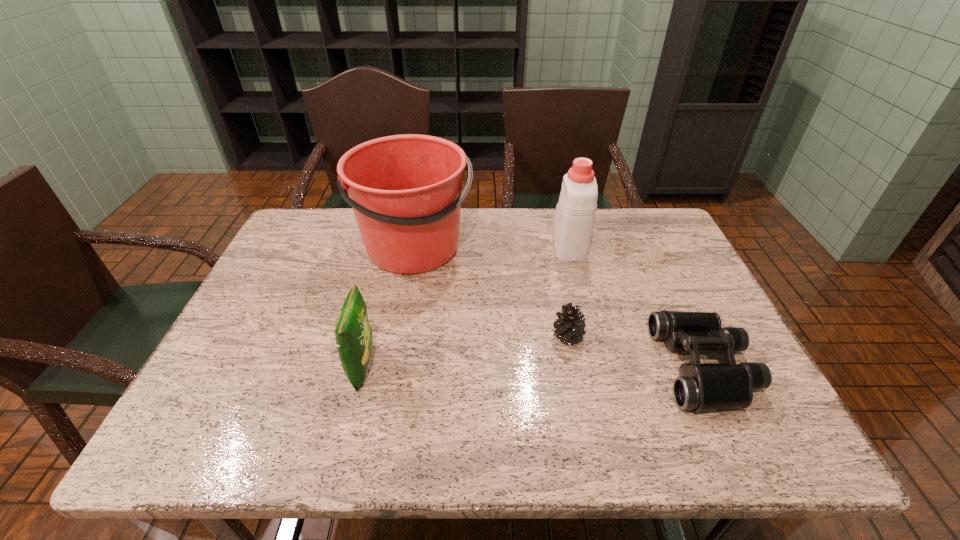
Where is `free location at the near edge of the desktop`? The height and width of the screenshot is (540, 960). free location at the near edge of the desktop is located at coordinates (298, 455).

You are a GUI agent. You are given a task and a screenshot of the screen. Output one action in this format:
    pyautogui.click(x=<x>, y=<y>)
    Task: Click on the vacant space at the left edge of the desktop
    
    Given the screenshot: What is the action you would take?
    pyautogui.click(x=300, y=272)

Where is `free spot at the right edge of the desktop`? This screenshot has width=960, height=540. free spot at the right edge of the desktop is located at coordinates (680, 291).

In the image, there is a desktop. Where is `blank space at the far right corner`? This screenshot has height=540, width=960. blank space at the far right corner is located at coordinates (650, 234).

The width and height of the screenshot is (960, 540). Identify the location of vacant space at the near right corner of the desktop. (791, 452).

I want to click on vacant area that lies between the bucket and the detergent, so click(x=492, y=245).

You are a GUI agent. You are given a task and a screenshot of the screen. Output one action in this format:
    pyautogui.click(x=<x>, y=<y>)
    Task: Click on the vacant space that is in between the pinecone and the third shortest object
    
    Given the screenshot: What is the action you would take?
    pyautogui.click(x=465, y=351)

What are the coordinates of `vacant area between the third shortest object and the bucket` in the screenshot? It's located at (389, 307).

The width and height of the screenshot is (960, 540). Find the location of `vacant point located between the pinecone and the bucket`. vacant point located between the pinecone and the bucket is located at coordinates tap(492, 292).

Where is `vacant space that is in between the pinecone and the bucket`? vacant space that is in between the pinecone and the bucket is located at coordinates (492, 292).